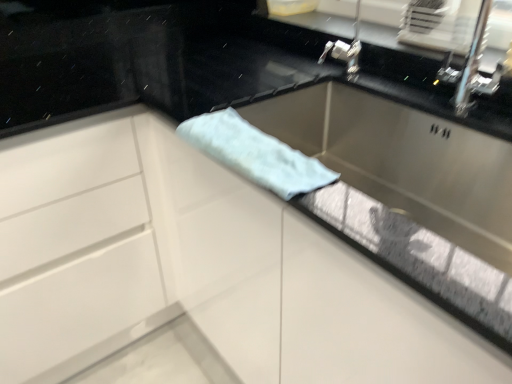
I want to click on light blue fabric at center, so click(x=255, y=153).

Measure the distance between point (266, 151) and camera.

The distance of point (266, 151) from camera is 30.55 inches.

The image size is (512, 384). Describe the element at coordinates (255, 153) in the screenshot. I see `light blue fabric at center` at that location.

This screenshot has height=384, width=512. I want to click on white glossy cabinet at left, so click(131, 249).

What do you see at coordinates (131, 249) in the screenshot?
I see `white glossy cabinet at left` at bounding box center [131, 249].

Measure the distance between white glossy cabinet at left and camera.

white glossy cabinet at left is 28.75 inches from camera.

Locate an element on the screen. The image size is (512, 384). light blue fabric at center is located at coordinates (255, 153).

Can you confirm if white glossy cabinet at left is positioned to the right of light blue fabric at center?

Incorrect, white glossy cabinet at left is not on the right side of light blue fabric at center.

Considering the positions of objects white glossy cabinet at left and light blue fabric at center in the image provided, who is in front, white glossy cabinet at left or light blue fabric at center?

light blue fabric at center is closer to the camera.

Does point (234, 284) come closer to viewer compared to point (248, 162)?

No, it is behind (248, 162).

From the image's perspective, does white glossy cabinet at left appear lower than light blue fabric at center?

Correct, white glossy cabinet at left appears lower than light blue fabric at center in the image.

From a real-world perspective, which is physically below, white glossy cabinet at left or light blue fabric at center?

white glossy cabinet at left.

Between white glossy cabinet at left and light blue fabric at center, which one has larger width?

white glossy cabinet at left.

Considering the sizes of objects white glossy cabinet at left and light blue fabric at center in the image provided, who is taller, white glossy cabinet at left or light blue fabric at center?

white glossy cabinet at left is taller.

Does white glossy cabinet at left have a smaller size compared to light blue fabric at center?

Incorrect, white glossy cabinet at left is not smaller in size than light blue fabric at center.

Would you say light blue fabric at center is part of white glossy cabinet at left's contents?

No.

Would you say white glossy cabinet at left is a long distance from light blue fabric at center?

white glossy cabinet at left is near light blue fabric at center, not far away.

Does white glossy cabinet at left turn towards light blue fabric at center?

Yes.

Identify the location of beach towel on the right of white glossy cabinet at left. This screenshot has width=512, height=384. (255, 153).

Between light blue fabric at center and white glossy cabinet at left, which one appears on the right side from the viewer's perspective?

light blue fabric at center is more to the right.

Is light blue fabric at center positioned behind white glossy cabinet at left?

No, light blue fabric at center is closer to the camera.

Is point (308, 157) behind point (15, 379)?

Yes, point (308, 157) is farther from viewer.

From the image's perspective, who appears lower, light blue fabric at center or white glossy cabinet at left?

white glossy cabinet at left appears lower in the image.

From a real-world perspective, does light blue fabric at center stand above white glossy cabinet at left?

Correct, in the physical world, light blue fabric at center is higher than white glossy cabinet at left.

Considering the sizes of objects light blue fabric at center and white glossy cabinet at left in the image provided, who is thinner, light blue fabric at center or white glossy cabinet at left?

light blue fabric at center is thinner.

Can you confirm if light blue fabric at center is shorter than white glossy cabinet at left?

Yes.

Is light blue fabric at center bigger or smaller than white glossy cabinet at left?

light blue fabric at center is smaller than white glossy cabinet at left.

Is light blue fabric at center spatially inside white glossy cabinet at left, or outside of it?

The correct answer is: outside.

Is light blue fabric at center far from white glossy cabinet at left?

No, light blue fabric at center is in close proximity to white glossy cabinet at left.

Is light blue fabric at center looking in the opposite direction of white glossy cabinet at left?

That's not correct — light blue fabric at center is not looking away from white glossy cabinet at left.

How different are the orientations of light blue fabric at center and white glossy cabinet at left in degrees?

The facing directions of light blue fabric at center and white glossy cabinet at left are 89 degrees apart.

How much distance is there between light blue fabric at center and white glossy cabinet at left?

A distance of 13.31 inches exists between light blue fabric at center and white glossy cabinet at left.

Locate an element on the screen. cabinetry behind the light blue fabric at center is located at coordinates (131, 249).

Where is `cabinetry behind the light blue fabric at center`? The width and height of the screenshot is (512, 384). cabinetry behind the light blue fabric at center is located at coordinates (131, 249).

Where is `beach towel above the white glossy cabinet at left (from a real-world perspective)`? beach towel above the white glossy cabinet at left (from a real-world perspective) is located at coordinates (255, 153).